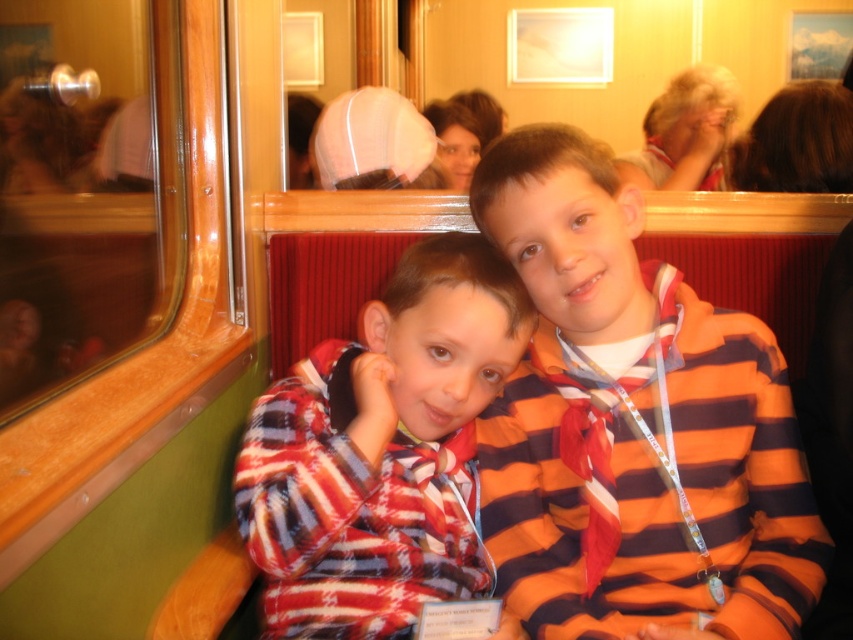
You are a photographer trying to capture a candid shot of two boys sitting in a train car. You need to ensure that both the striped fabric shirt at center and the striped fleece jacket at center are in focus. Given that your camera has a depth of field that can cover 7 inches, will both items be in focus?

The striped fabric shirt at center and striped fleece jacket at center are 6.77 inches apart. Since the distance between them is less than the camera depth of field of 7 inches, both items will be in focus.

You are a photographer trying to capture both the striped fabric shirt at center and the striped fleece jacket at center in a single frame. Given their sizes, which object would you need to position closer to the camera to ensure both fit in the frame?

Since the striped fabric shirt at center is smaller than the striped fleece jacket at center, you should place the striped fabric shirt at center closer to the camera to ensure both fit within the frame.